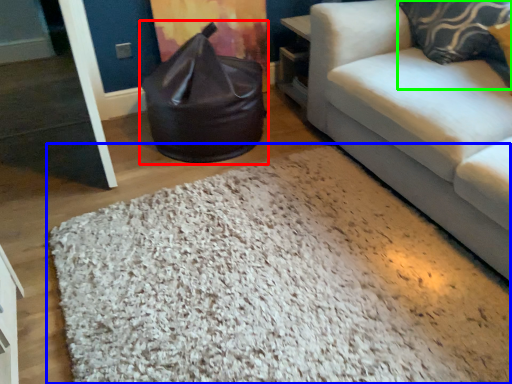
Question: Which is farther away from bean bag chair (highlighted by a red box)? mat (highlighted by a blue box) or pillow (highlighted by a green box)?

Choices:
 (A) mat
 (B) pillow

Answer: (B)